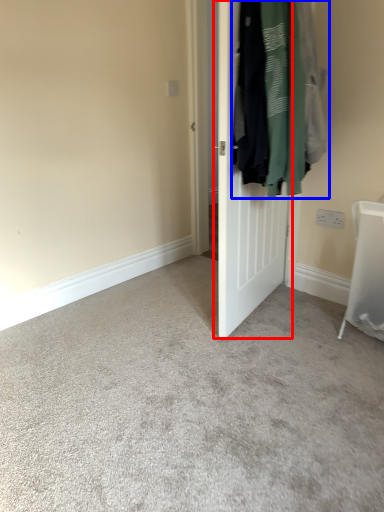
Question: Which object is closer to the camera taking this photo, door (highlighted by a red box) or laundry (highlighted by a blue box)?

Choices:
 (A) door
 (B) laundry

Answer: (B)